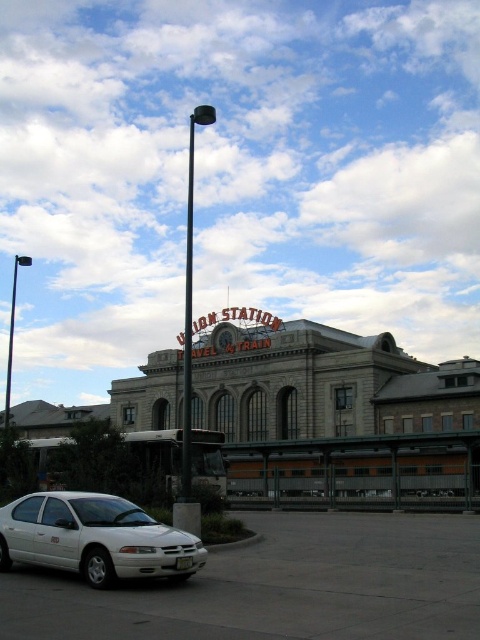
Who is positioned more to the left, white matte sedan at lower left or black metal pole at center?

black metal pole at center is more to the left.

Which is behind, point (165, 552) or point (190, 378)?

Point (190, 378)

Is point (69, 497) behind point (184, 417)?

That is False.

Identify the location of white matte sedan at lower left. (95, 538).

Based on the photo, does black metal pole at upper center have a greater height compared to black metal pole at upper left?

Yes.

Is point (191, 257) farther from camera compared to point (11, 323)?

No, (191, 257) is in front of (11, 323).

Which is in front, point (190, 476) or point (13, 317)?

Point (190, 476) is in front.

The width and height of the screenshot is (480, 640). Find the location of `black metal pole at upper center`. black metal pole at upper center is located at coordinates (190, 348).

Between point (462, 419) and point (180, 484), which one is positioned in front?

Positioned in front is point (180, 484).

Does stone building at center appear over black metal pole at center?

Actually, stone building at center is below black metal pole at center.

Measure the distance between stone building at center and camera.

stone building at center and camera are 134.69 feet apart from each other.

At what (x,y) coordinates should I click in order to perform the action: click on stone building at center. Please return your answer as a coordinate pair (x, y). Image resolution: width=480 pixels, height=640 pixels. Looking at the image, I should click on (335, 412).